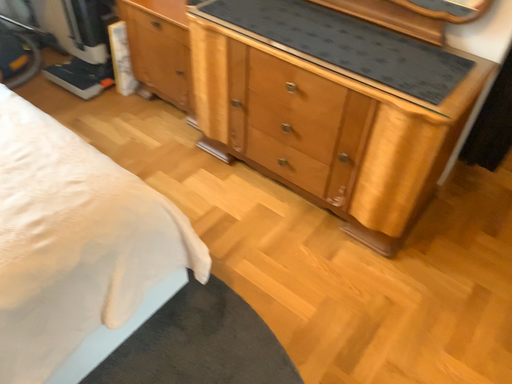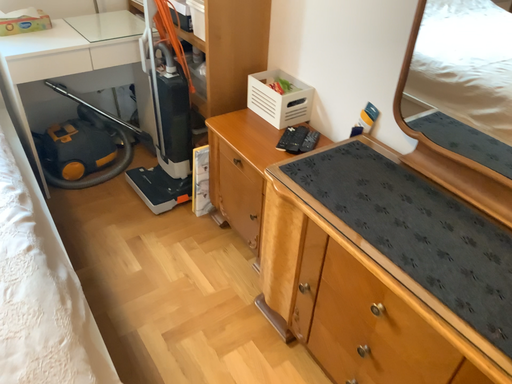
Question: Which way did the camera rotate in the video?

Choices:
 (A) rotated downward
 (B) rotated upward

Answer: (B)